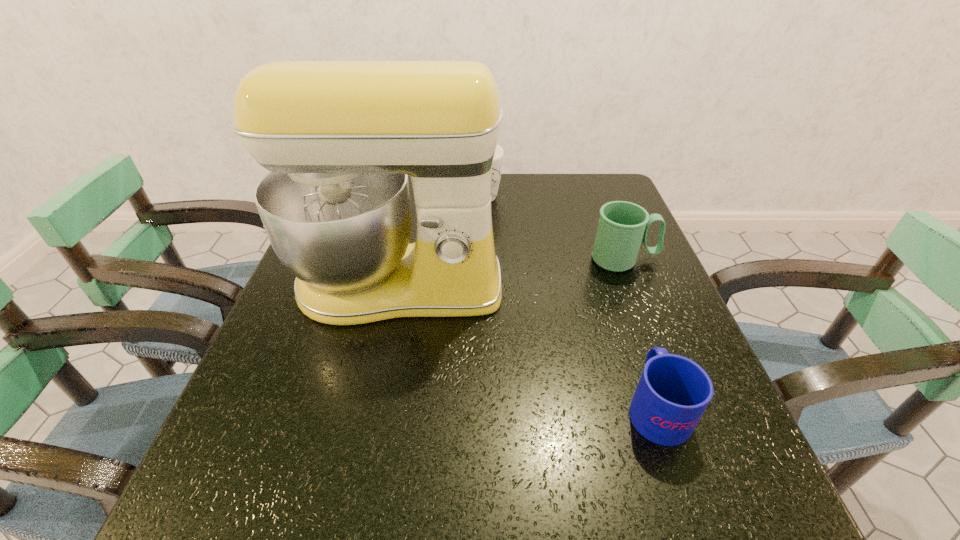
I want to click on vacant region between the mixer and the shortest mug, so click(x=527, y=347).

At what (x,y) coordinates should I click in order to perform the action: click on vacant area that lies between the farthest mug and the nearest mug. Please return your answer as a coordinate pair (x, y). The image size is (960, 540). Looking at the image, I should click on (565, 302).

The width and height of the screenshot is (960, 540). In order to click on vacant space that's between the second farthest mug and the farthest mug in this screenshot , I will do `click(549, 228)`.

At what (x,y) coordinates should I click in order to perform the action: click on vacant region between the shortest object and the farthest object. Please return your answer as a coordinate pair (x, y). Looking at the image, I should click on (565, 302).

Identify the location of vacant point located between the second farthest mug and the nearest object. This screenshot has width=960, height=540. (640, 333).

The width and height of the screenshot is (960, 540). I want to click on object that is the closest to the nearest mug, so click(340, 138).

Find the location of `object that is the second closest to the tallest object`. object that is the second closest to the tallest object is located at coordinates (623, 226).

Identify which mug is the third nearest to the tallest object. Please provide its 2D coordinates. Your answer should be formatted as a tuple, i.e. [(x, y)], where the tuple contains the x and y coordinates of a point satisfying the conditions above.

[(673, 392)]

Select which mug appears as the second closest to the second farthest mug. Please provide its 2D coordinates. Your answer should be formatted as a tuple, i.e. [(x, y)], where the tuple contains the x and y coordinates of a point satisfying the conditions above.

[(673, 392)]

You are a GUI agent. You are given a task and a screenshot of the screen. Output one action in this format:
    pyautogui.click(x=<x>, y=<y>)
    Task: Click on the free space that satisfies the following two spatial constraints: 1. on the side of the farthest mug with the handle; 2. on the side of the mixer with the control knob
    
    Given the screenshot: What is the action you would take?
    pyautogui.click(x=472, y=286)